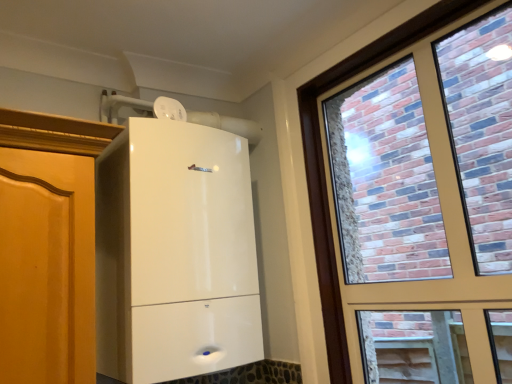
Question: Should I look upward or downward to see white glossy boiler at center?

Choices:
 (A) up
 (B) down

Answer: (B)

Question: Can brick-patterned glass window at right be found inside white glossy boiler at center?

Choices:
 (A) yes
 (B) no

Answer: (B)

Question: Is white glossy boiler at center oriented away from brick-patterned glass window at right?

Choices:
 (A) yes
 (B) no

Answer: (B)

Question: From the image's perspective, is white glossy boiler at center located beneath brick-patterned glass window at right?

Choices:
 (A) yes
 (B) no

Answer: (A)

Question: Is white glossy boiler at center outside of brick-patterned glass window at right?

Choices:
 (A) yes
 (B) no

Answer: (A)

Question: From a real-world perspective, does white glossy boiler at center stand above brick-patterned glass window at right?

Choices:
 (A) yes
 (B) no

Answer: (A)

Question: Is white glossy boiler at center wider than brick-patterned glass window at right?

Choices:
 (A) no
 (B) yes

Answer: (B)

Question: Are brick-patterned glass window at right and white glossy boiler at center far apart?

Choices:
 (A) no
 (B) yes

Answer: (A)

Question: From a real-world perspective, is brick-patterned glass window at right positioned under white glossy boiler at center based on gravity?

Choices:
 (A) yes
 (B) no

Answer: (A)

Question: Is brick-patterned glass window at right closer to the viewer compared to white glossy boiler at center?

Choices:
 (A) yes
 (B) no

Answer: (A)

Question: Is brick-patterned glass window at right smaller than white glossy boiler at center?

Choices:
 (A) no
 (B) yes

Answer: (B)

Question: Can you confirm if brick-patterned glass window at right is taller than white glossy boiler at center?

Choices:
 (A) yes
 (B) no

Answer: (A)

Question: Is brick-patterned glass window at right to the left of white glossy boiler at center from the viewer's perspective?

Choices:
 (A) yes
 (B) no

Answer: (B)

Question: Considering the relative positions of brick-patterned glass window at right and white glossy boiler at center in the image provided, is brick-patterned glass window at right to the left or to the right of white glossy boiler at center?

Choices:
 (A) right
 (B) left

Answer: (A)